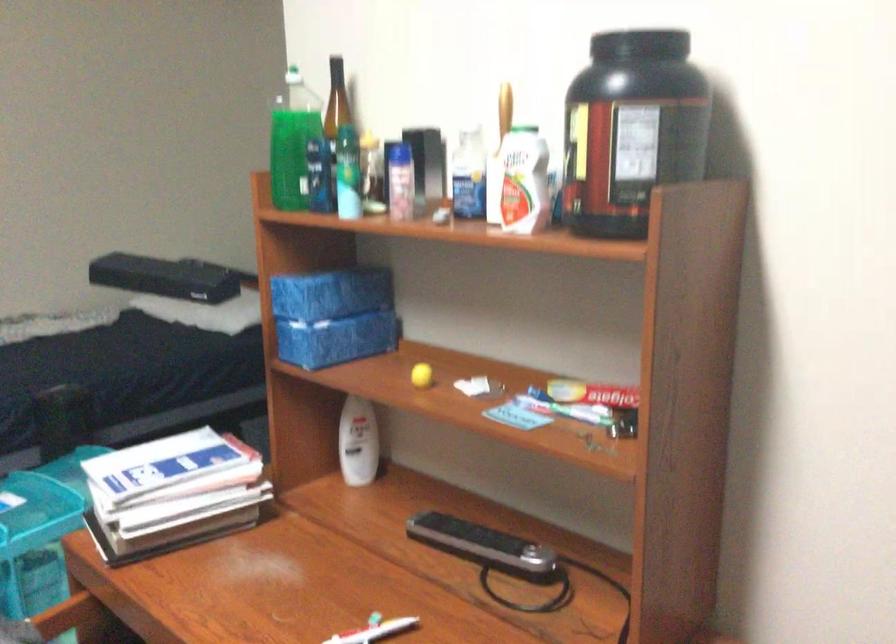
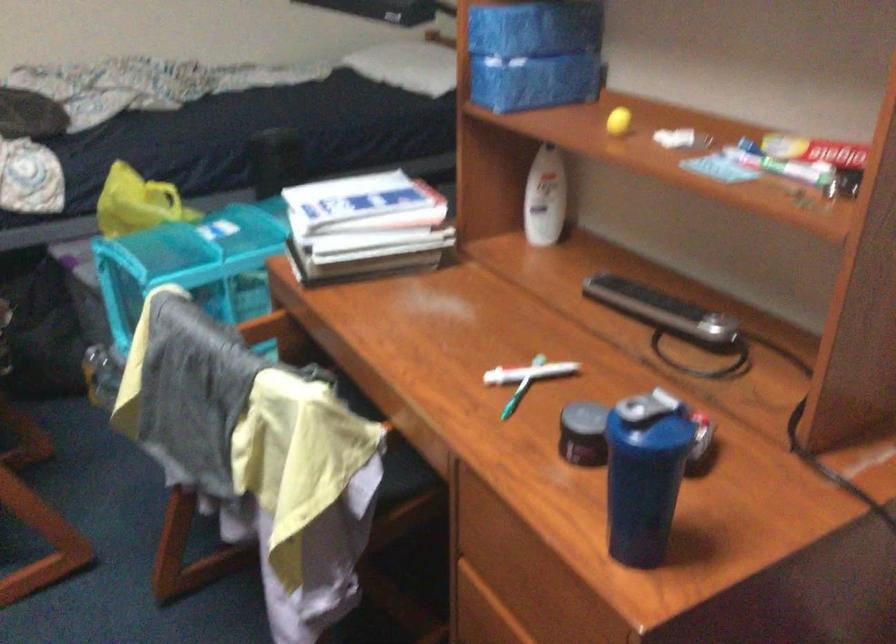
In the second image, find the point that corresponds to point 570,406 in the first image.

(780, 164)